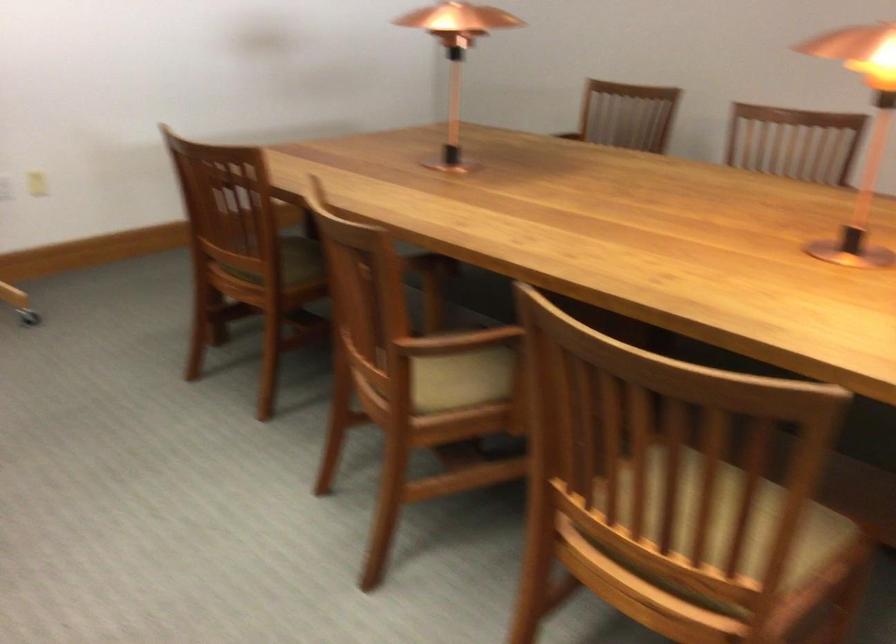
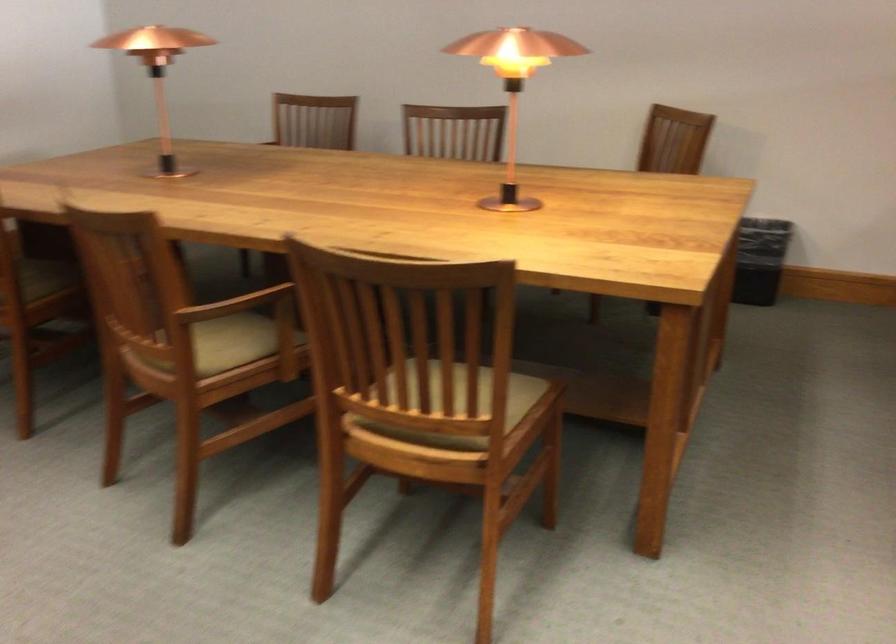
In the second image, find the point that corresponds to the point at 464,342 in the first image.

(236, 304)